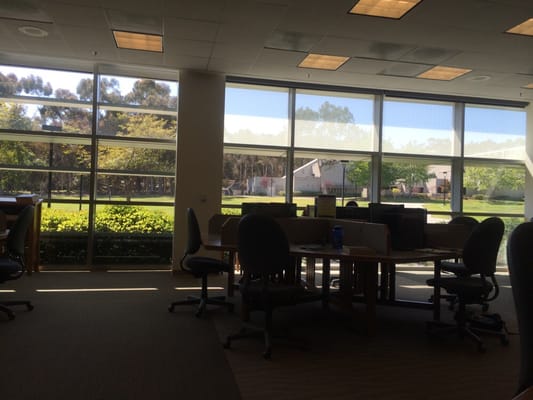
At what (x,y) coordinates should I click in order to perform the action: click on troffer lights. Please return your answer as a coordinate pair (x, y). This screenshot has width=533, height=400. Looking at the image, I should click on (527, 28), (530, 85), (443, 71), (387, 8), (324, 62), (129, 42).